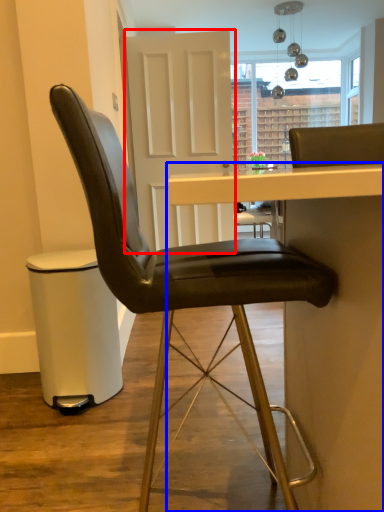
Question: Which object is closer to the camera taking this photo, glass door (highlighted by a red box) or table (highlighted by a blue box)?

Choices:
 (A) glass door
 (B) table

Answer: (B)